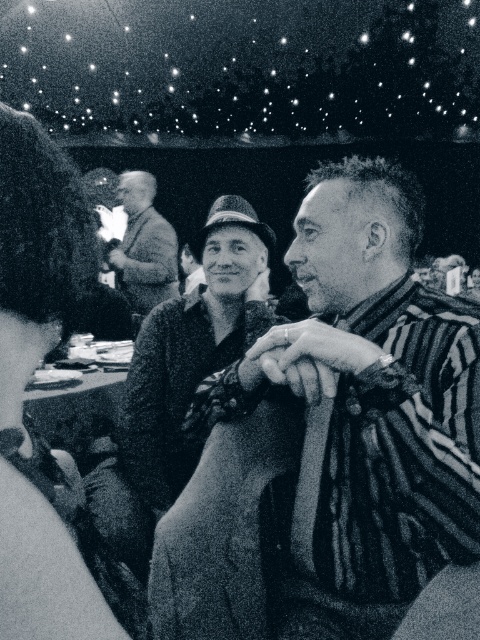
Question: Observing the image, what is the correct spatial positioning of striped sweater at center in reference to light brown textured sweater at center?

Choices:
 (A) left
 (B) right

Answer: (B)

Question: Where is smooth fabric napkin at left located in relation to light brown textured sweater at center in the image?

Choices:
 (A) left
 (B) right

Answer: (B)

Question: Which of the following is the closest to the observer?

Choices:
 (A) (467, 362)
 (B) (49, 346)
 (C) (149, 291)

Answer: (B)

Question: Which object is farther from the camera taking this photo?

Choices:
 (A) striped sweater at center
 (B) light brown textured sweater at center

Answer: (B)

Question: Which object is closer to the camera taking this photo?

Choices:
 (A) smooth fabric napkin at left
 (B) light brown textured sweater at center

Answer: (A)

Question: From the image, what is the correct spatial relationship of smooth fabric napkin at left in relation to light brown textured sweater at center?

Choices:
 (A) above
 (B) below

Answer: (B)